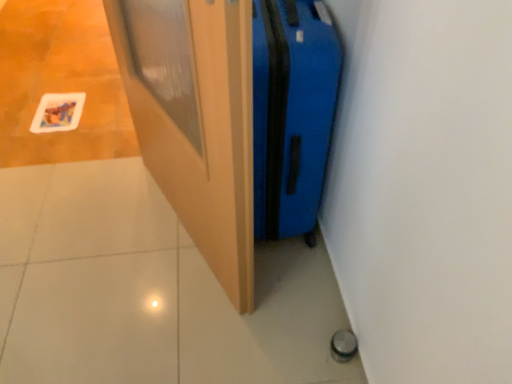
Question: Can you confirm if blue hardshell suitcase at center-right is bigger than wooden door at center?

Choices:
 (A) yes
 (B) no

Answer: (A)

Question: Does blue hardshell suitcase at center-right lie behind wooden door at center?

Choices:
 (A) yes
 (B) no

Answer: (A)

Question: Is blue hardshell suitcase at center-right facing away from wooden door at center?

Choices:
 (A) no
 (B) yes

Answer: (B)

Question: Considering the relative sizes of blue hardshell suitcase at center-right and wooden door at center in the image provided, is blue hardshell suitcase at center-right shorter than wooden door at center?

Choices:
 (A) no
 (B) yes

Answer: (B)

Question: From the image's perspective, is blue hardshell suitcase at center-right on top of wooden door at center?

Choices:
 (A) no
 (B) yes

Answer: (B)

Question: Is blue hardshell suitcase at center-right beside wooden door at center?

Choices:
 (A) yes
 (B) no

Answer: (B)

Question: From the image's perspective, is wooden door at center above blue hardshell suitcase at center-right?

Choices:
 (A) no
 (B) yes

Answer: (A)

Question: Does wooden door at center have a lesser height compared to blue hardshell suitcase at center-right?

Choices:
 (A) no
 (B) yes

Answer: (A)

Question: Can we say wooden door at center lies outside blue hardshell suitcase at center-right?

Choices:
 (A) no
 (B) yes

Answer: (B)

Question: Can you confirm if wooden door at center is positioned to the left of blue hardshell suitcase at center-right?

Choices:
 (A) yes
 (B) no

Answer: (A)

Question: Is wooden door at center far away from blue hardshell suitcase at center-right?

Choices:
 (A) no
 (B) yes

Answer: (A)

Question: From a real-world perspective, is wooden door at center on blue hardshell suitcase at center-right?

Choices:
 (A) yes
 (B) no

Answer: (A)

Question: From a real-world perspective, is blue hardshell suitcase at center-right above or below wooden door at center?

Choices:
 (A) above
 (B) below

Answer: (B)